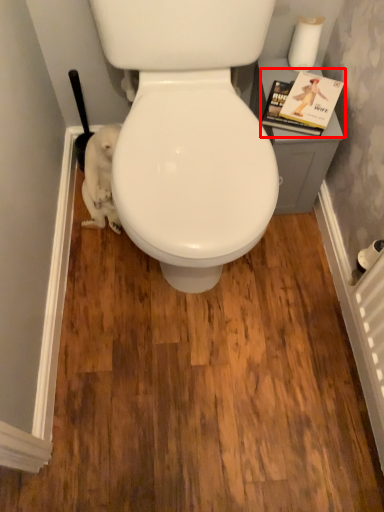
Question: From the image, what is the correct spatial relationship of magazine (annotated by the red box) in relation to toilet paper?

Choices:
 (A) left
 (B) right

Answer: (A)